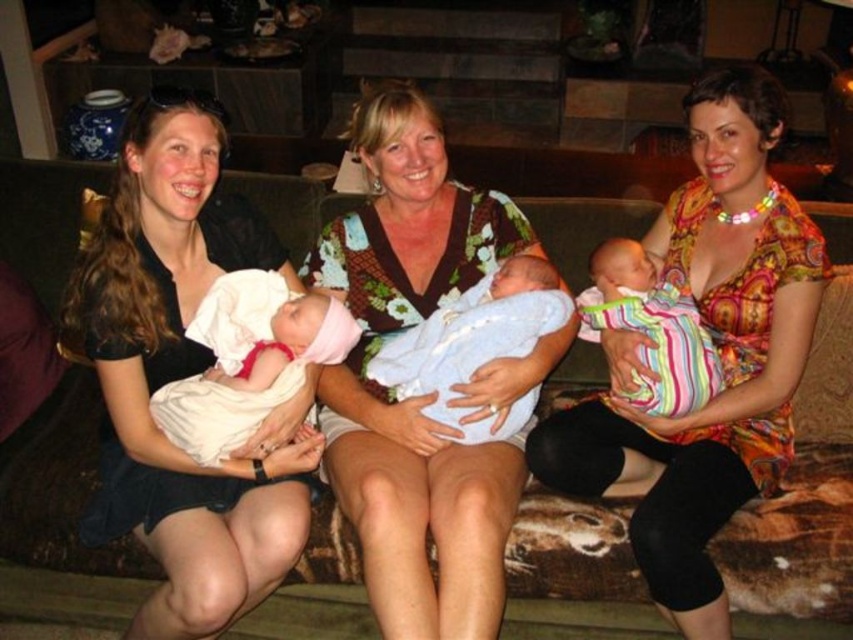
Is matte floral dress at center to the left of white clothed baby at center from the viewer's perspective?

No, matte floral dress at center is not to the left of white clothed baby at center.

Who is shorter, matte floral dress at center or white clothed baby at center?

white clothed baby at center is shorter.

Is point (560, 470) positioned behind point (167, 424)?

Yes, point (560, 470) is farther from viewer.

The image size is (853, 640). Identify the location of matte floral dress at center. (717, 348).

Based on the photo, between matte black dress at left and white clothed baby at center, which one is positioned higher?

white clothed baby at center is higher up.

Where is `matte black dress at left`? The image size is (853, 640). matte black dress at left is located at coordinates (183, 376).

Is point (263, 461) closer to viewer compared to point (747, 410)?

Yes, it is.

Image resolution: width=853 pixels, height=640 pixels. Find the location of `matte black dress at left`. matte black dress at left is located at coordinates (183, 376).

This screenshot has width=853, height=640. Identify the location of matte black dress at left. (183, 376).